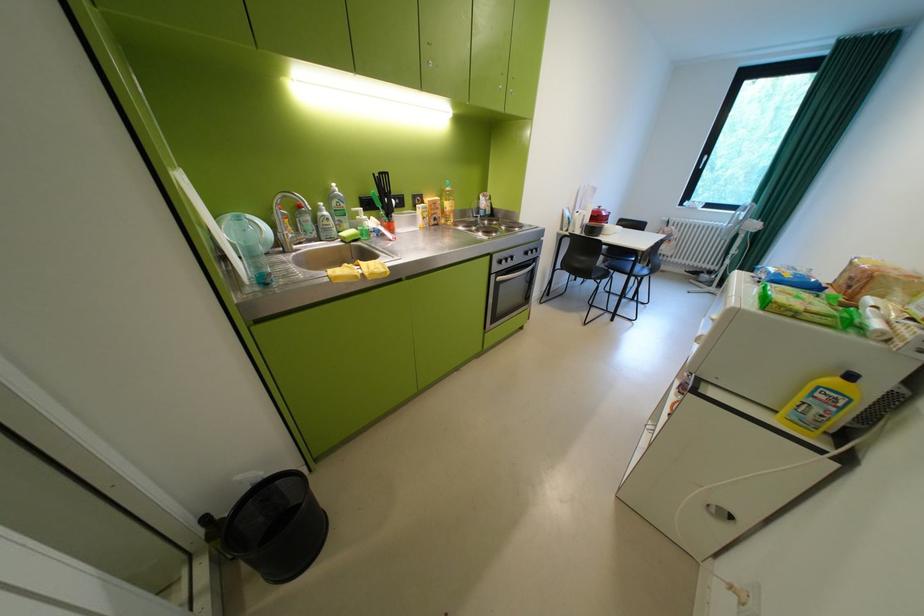
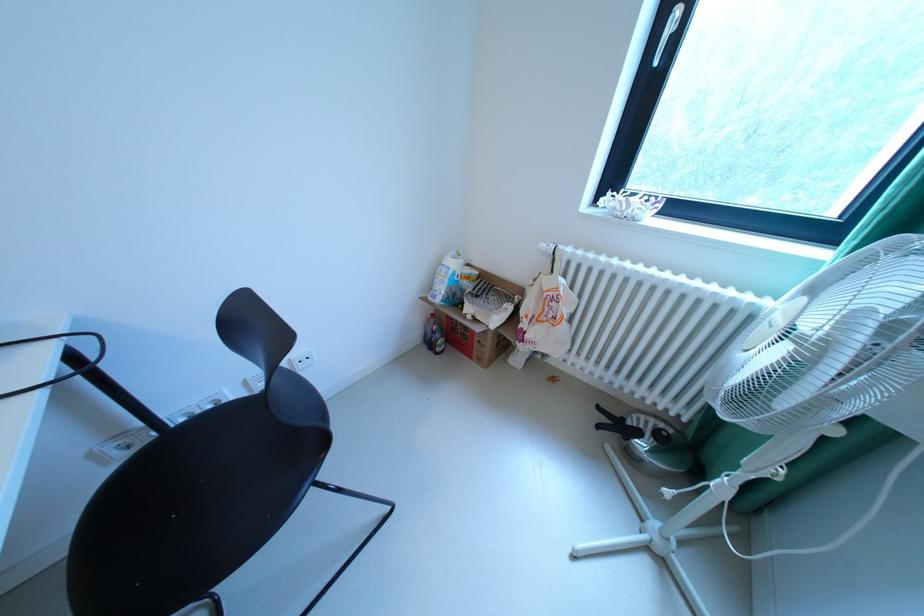
The images are taken continuously from a first-person perspective. In which direction are you moving?

The cameraman walked toward right, forward.